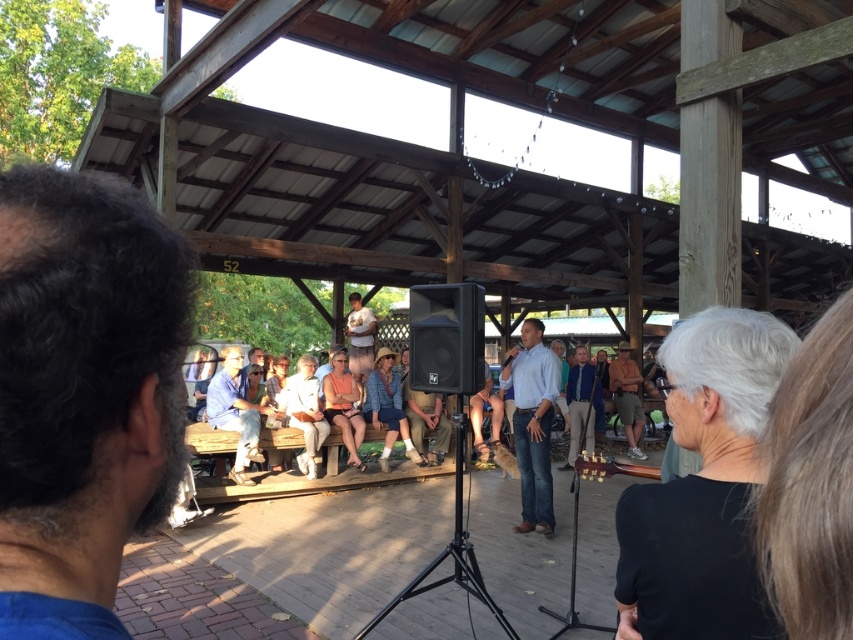
Which is in front, point (546, 516) or point (351, 320)?

Positioned in front is point (546, 516).

Can you confirm if blue jeans at center is wider than light brown wood shirt at center?

Incorrect, blue jeans at center's width does not surpass light brown wood shirt at center's.

Who is more distant from viewer, (531, 508) or (375, 323)?

The point (375, 323) is more distant.

This screenshot has height=640, width=853. Identify the location of blue jeans at center. (532, 422).

Is blue jeans at center bigger than light blue shirt at center?

Indeed, blue jeans at center has a larger size compared to light blue shirt at center.

I want to click on blue jeans at center, so click(532, 422).

What are the coordinates of `blue jeans at center` in the screenshot? It's located at (532, 422).

Is point (467, 285) less distant than point (583, 412)?

Yes, point (467, 285) is in front of point (583, 412).

Between black matte speaker at center and blue denim shirt at center, which one is positioned lower?

blue denim shirt at center is below.

At what (x,y) coordinates should I click in order to perform the action: click on black matte speaker at center. Please return your answer as a coordinate pair (x, y). Image resolution: width=853 pixels, height=640 pixels. Looking at the image, I should click on (445, 339).